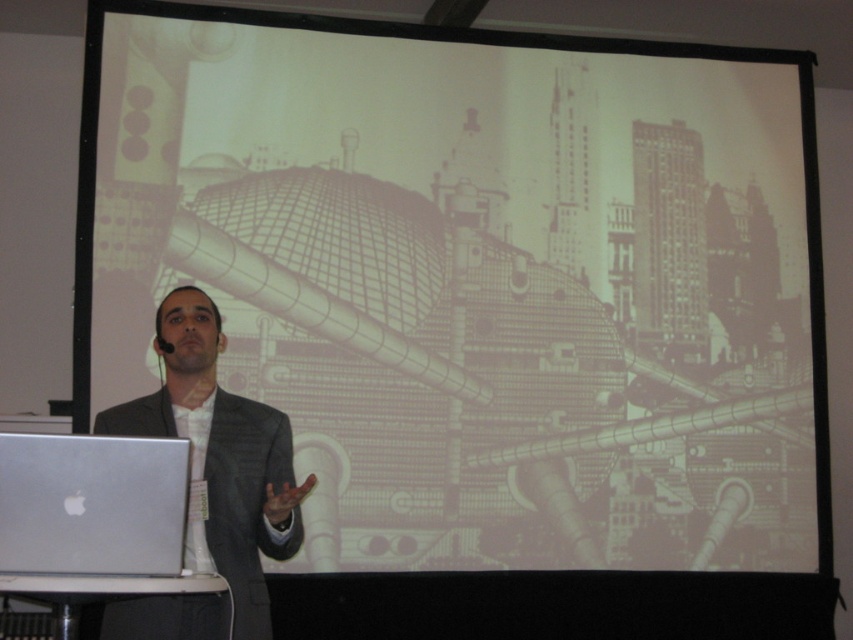
You are an event organizer who needs to set up a stage for a presentation. The stage has limited vertical space. You have the dark gray suit at center and the silver metallic laptop at lower left. Which object requires more vertical space due to its height?

The dark gray suit at center is much taller than the silver metallic laptop at lower left, so it requires more vertical space.

You are an event organizer setting up a stage. The dark gray suit at center and the silver metallic laptop at lower left are placed on the stage. You need to ensure there is enough space between them for a 1.2 meter wide banner. Is there sufficient space?

The dark gray suit at center might be wider than silver metallic laptop at lower left, so the space between them may not be sufficient for a 1.2 meter wide banner. Check the actual dimensions before placing the banner.

You are an event organizer setting up a presentation room. You need to ensure that the dark gray suit at center and the silver metallic laptop at lower left are visible to the audience. Which object should you adjust to be closer to the audience to ensure both are clearly seen?

The dark gray suit at center is already closer to the audience than the silver metallic laptop at lower left. To ensure both are clearly visible, you should adjust the silver metallic laptop at lower left to move it closer to the audience.